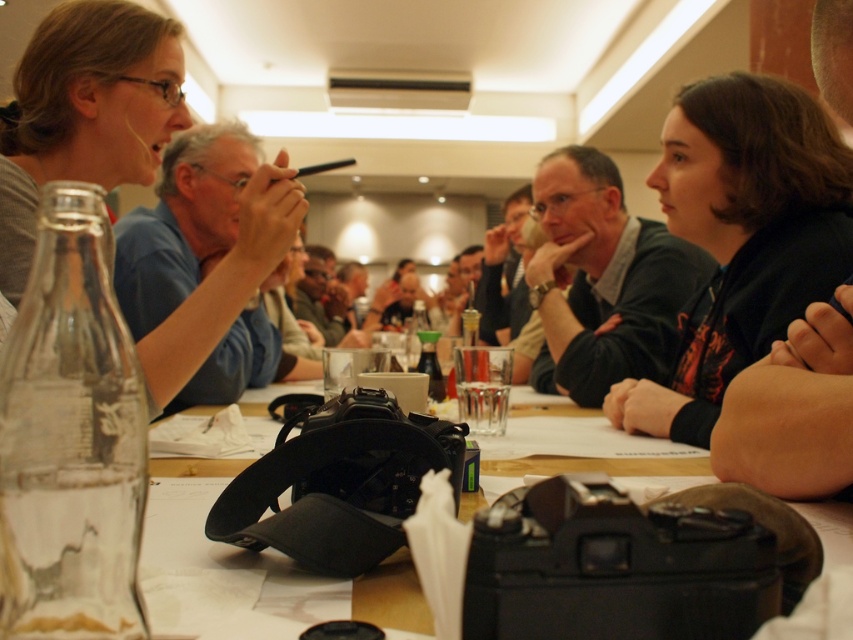
How distant is black matte jacket at right from matte gray shirt at upper left?

They are 37.84 inches apart.

Is black matte jacket at right wider than matte gray shirt at upper left?

Yes, black matte jacket at right is wider than matte gray shirt at upper left.

Does point (698, 184) come behind point (85, 109)?

Yes, point (698, 184) is farther from viewer.

Where is `black matte jacket at right`? black matte jacket at right is located at coordinates (741, 237).

What do you see at coordinates (252, 556) in the screenshot? This screenshot has width=853, height=640. I see `black plastic camera at center` at bounding box center [252, 556].

Is point (810, 520) positioned in front of point (26, 173)?

Yes, it is.

The image size is (853, 640). Find the location of `black plastic camera at center`. black plastic camera at center is located at coordinates (252, 556).

From the picture: Who is shorter, clear glass bottle at lower left or black plastic camera at center?

With less height is black plastic camera at center.

Between clear glass bottle at lower left and black plastic camera at center, which one has more height?

Standing taller between the two is clear glass bottle at lower left.

Is point (115, 305) in front of point (355, 596)?

That is True.

Image resolution: width=853 pixels, height=640 pixels. I want to click on clear glass bottle at lower left, so click(x=70, y=440).